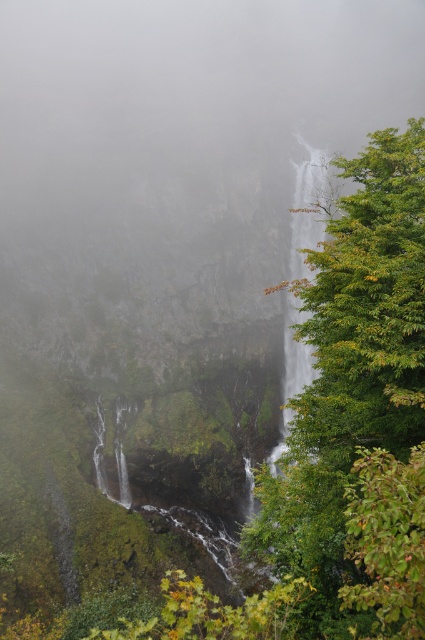
From the picture: You are standing at the base of the cliff in the misty mountain landscape. You notice a point marked at coordinates (175, 150). What natural feature is located at this point?

The foggy mist at center is located at point (175, 150).

You are a hiker standing at the edge of the cliff overlooking the waterfalls. You notice foggy mist at center and clear water at center. Which object is above the other?

The foggy mist at center is positioned over clear water at center, so the foggy mist is above the clear water.